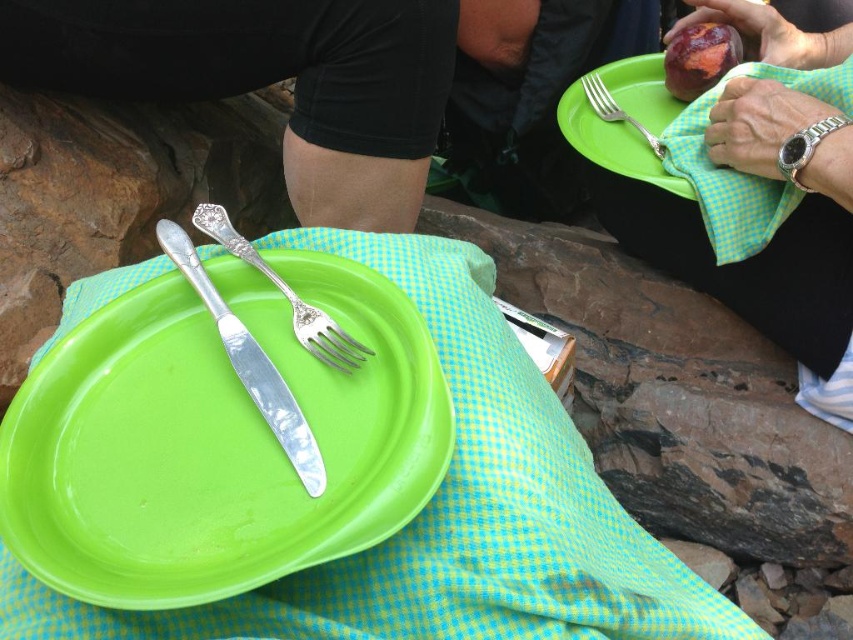
Can you confirm if polished silver knife at center is taller than silver metallic fork at upper right?

Correct, polished silver knife at center is much taller as silver metallic fork at upper right.

Does point (311, 493) come farther from viewer compared to point (648, 134)?

No.

Image resolution: width=853 pixels, height=640 pixels. I want to click on polished silver knife at center, so click(250, 364).

Looking at this image, does green plastic plate at center come in front of silver polished fork at center?

Yes, it is.

The height and width of the screenshot is (640, 853). What do you see at coordinates (218, 440) in the screenshot? I see `green plastic plate at center` at bounding box center [218, 440].

Is point (224, 525) positioned before point (262, 260)?

That is True.

Locate an element on the screen. The width and height of the screenshot is (853, 640). green plastic plate at center is located at coordinates (218, 440).

Is matte silver fork at upper center to the right of silver polished fork at center from the viewer's perspective?

Yes, matte silver fork at upper center is to the right of silver polished fork at center.

Who is more distant from viewer, (843,218) or (302,332)?

The point (843,218) is more distant.

Locate an element on the screen. matte silver fork at upper center is located at coordinates (772, 236).